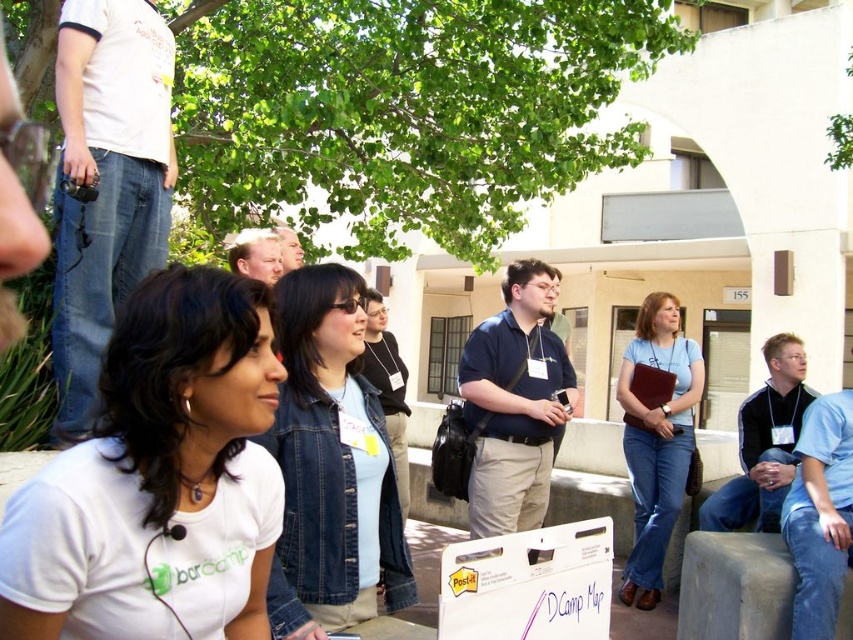
You are organizing a photo shoot and need to ensure that the white matte shirt at lower left and the denim jacket at center are visible in the frame. Given their sizes, which clothing item might require you to adjust the camera angle to ensure it is fully captured?

The denim jacket at center is larger than the white matte shirt at lower left, so the camera angle might need adjustment to fully capture the denim jacket at center.

You are standing at the center of the image and want to walk towards the two points marked in the scene. Which point, point (189, 465) or point (672, 460), would you reach first?

Point (189, 465) is in front of point (672, 460), so you would reach point (189, 465) first.